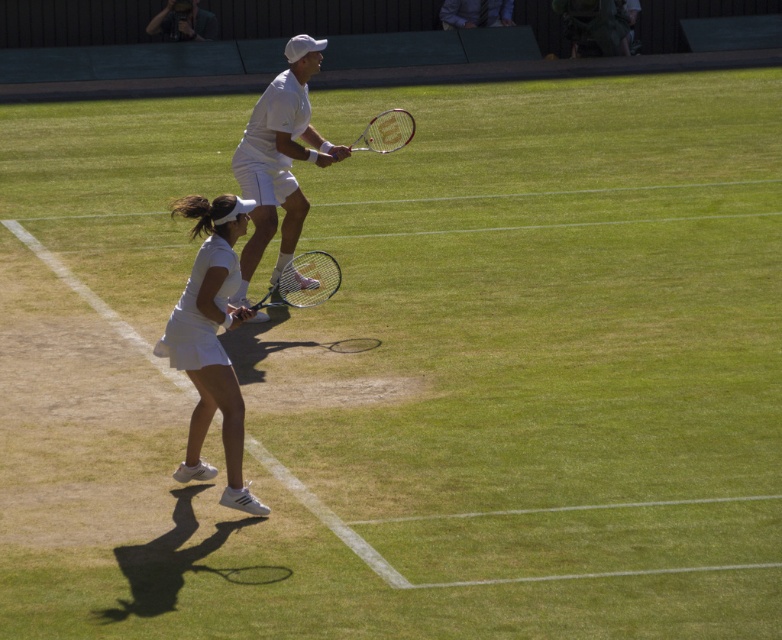
From the picture: In the image of the tennis match, there is a point at coordinates (210, 342). What object is located at this point?

The point at coordinates (210, 342) corresponds to the white matte tennis skirt at lower left.

You are a tennis player standing at the baseline during a match. You notice two points marked on the court. The first point is at coordinates point (275, 218) and the second is at point (287, 284). If you want to reach the point closer to the net, which one should you aim for?

The point closer to the net is point (287, 284) because it is closer to the net than point (275, 218), which is further away from the net.